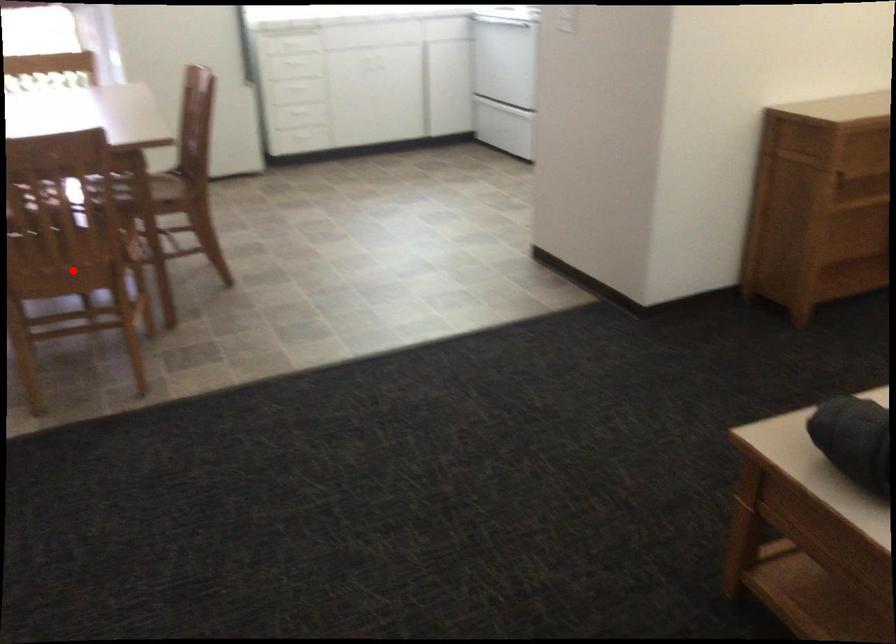
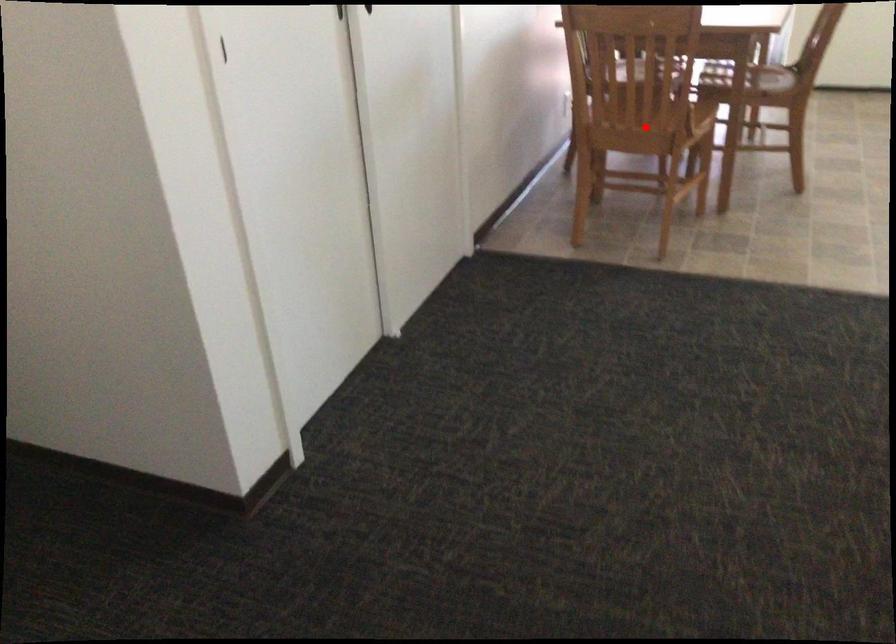
I am providing you with two images of the same scene from different viewpoints. A red point is marked on the first image and another point is marked on the second image. Is the red point in image1 aligned with the point shown in image2?

Yes